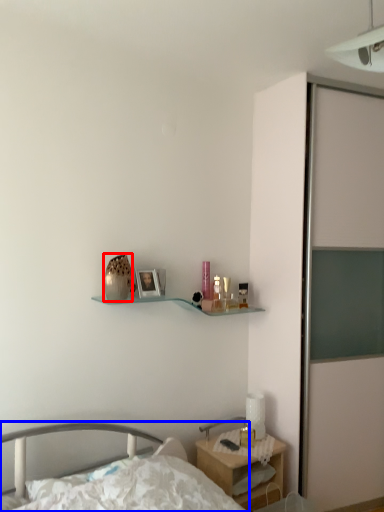
Question: Which object is further to the camera taking this photo, vase (highlighted by a red box) or bed (highlighted by a blue box)?

Choices:
 (A) vase
 (B) bed

Answer: (A)